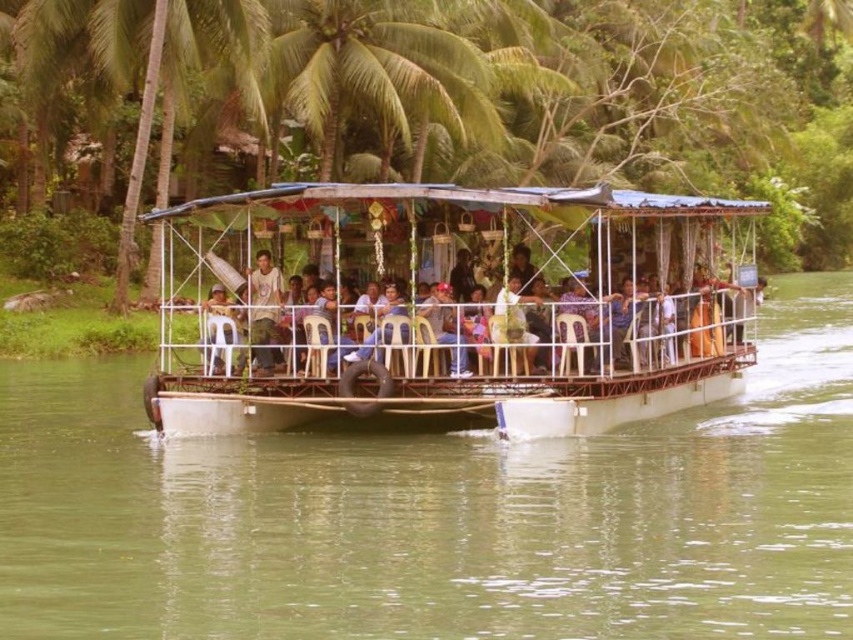
At what (x,y) coordinates should I click in order to perform the action: click on green plastic boat at center. Please return your answer as a coordinate pair (x, y). Looking at the image, I should click on (439, 513).

Can you confirm if green plastic boat at center is shorter than white plastic chair at center?

No, green plastic boat at center is not shorter than white plastic chair at center.

Is point (161, 445) closer to viewer compared to point (560, 308)?

No, (161, 445) is further to viewer.

The image size is (853, 640). Identify the location of green plastic boat at center. (439, 513).

Does green plastic boat at center have a greater height compared to white plastic boat at center?

No.

Can you confirm if green plastic boat at center is shorter than white plastic boat at center?

Correct, green plastic boat at center is not as tall as white plastic boat at center.

Is point (13, 528) farther from camera compared to point (697, 371)?

No, it is not.

The height and width of the screenshot is (640, 853). What are the coordinates of `green plastic boat at center` in the screenshot? It's located at (439, 513).

Between white plastic boat at center and white plastic chair at center, which one is positioned higher?

white plastic boat at center is higher up.

Is white plastic boat at center shorter than white plastic chair at center?

Result: No, white plastic boat at center is not shorter than white plastic chair at center.

Find the location of a particular element. This screenshot has height=640, width=853. white plastic boat at center is located at coordinates (453, 308).

The image size is (853, 640). Find the location of `white plastic boat at center`. white plastic boat at center is located at coordinates (453, 308).